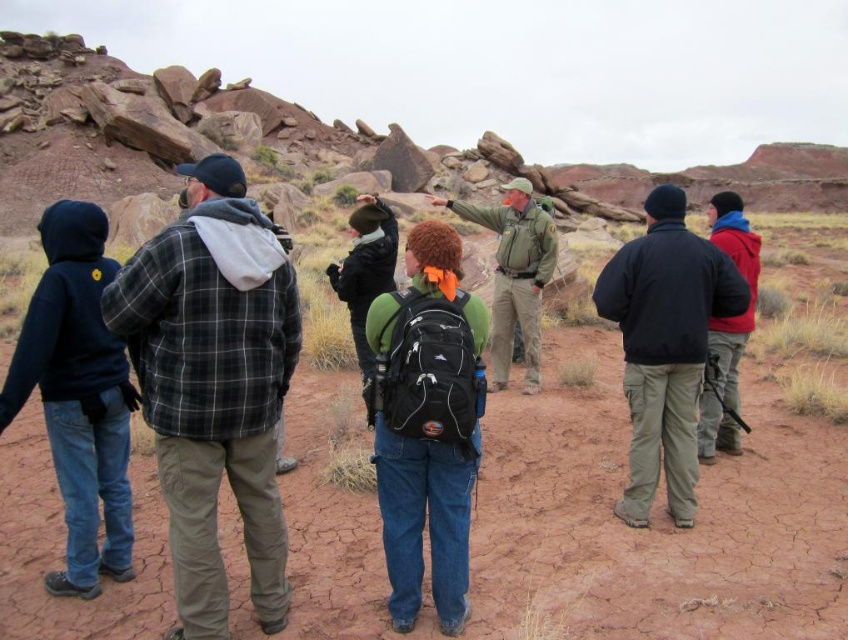
Question: Does dark blue hoodie at left appear under matte black backpack at center?

Choices:
 (A) yes
 (B) no

Answer: (A)

Question: Is dark blue jacket at right positioned in front of green matte jacket at center?

Choices:
 (A) yes
 (B) no

Answer: (A)

Question: Which of the following is the closest to the observer?

Choices:
 (A) dark blue hoodie at left
 (B) red fleece jacket at center

Answer: (A)

Question: Which of the following is the closest to the observer?

Choices:
 (A) (99, 496)
 (B) (644, 317)
 (C) (503, 364)
 (D) (252, 220)

Answer: (D)

Question: In this image, where is green matte jacket at center located relative to matte black backpack at center?

Choices:
 (A) below
 (B) above

Answer: (B)

Question: Which point appears closest to the camera in this image?

Choices:
 (A) (x=226, y=449)
 (B) (x=661, y=236)
 (C) (x=70, y=545)
 (D) (x=406, y=444)

Answer: (A)